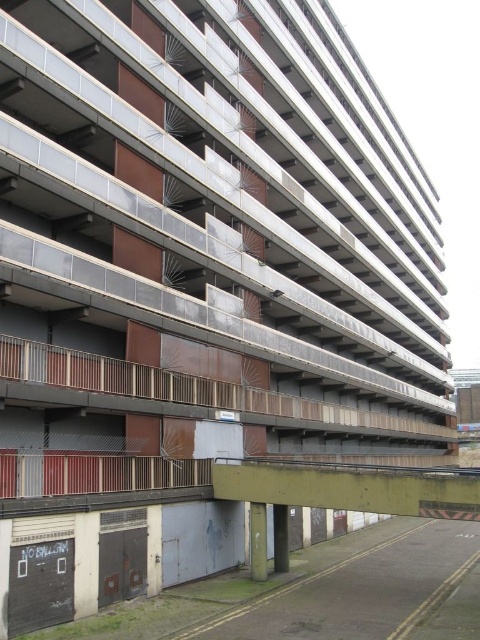
Question: Which point appears closest to the camera in this image?

Choices:
 (A) (411, 493)
 (B) (120, 369)

Answer: (A)

Question: Which object appears farthest from the camera in this image?

Choices:
 (A) brown wooden balcony at lower left
 (B) concrete bridge at lower center

Answer: (B)

Question: Can you confirm if brown wooden balcony at lower left is positioned below concrete bridge at lower center?

Choices:
 (A) no
 (B) yes

Answer: (A)

Question: Is brown wooden balcony at lower left further to the viewer compared to concrete bridge at lower center?

Choices:
 (A) no
 (B) yes

Answer: (A)

Question: Which point is closer to the camera?

Choices:
 (A) brown wooden balcony at lower left
 (B) concrete bridge at lower center

Answer: (A)

Question: Does brown wooden balcony at lower left have a smaller size compared to concrete bridge at lower center?

Choices:
 (A) yes
 (B) no

Answer: (B)